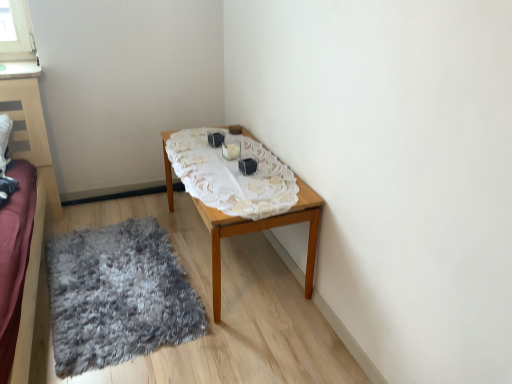
What do you see at coordinates (232, 175) in the screenshot? I see `white lace tablecloth at center` at bounding box center [232, 175].

Where is `gray shaggy rug at lower left`? The image size is (512, 384). gray shaggy rug at lower left is located at coordinates (118, 296).

From a real-world perspective, is wooden table at center above or below white lace tablecloth at center?

From a real-world perspective, wooden table at center is physically below white lace tablecloth at center.

Considering the sizes of objects wooden table at center and white lace tablecloth at center in the image provided, who is taller, wooden table at center or white lace tablecloth at center?

With more height is wooden table at center.

Can you confirm if wooden table at center is positioned to the right of white lace tablecloth at center?

Yes.

Where is `mat on the left of white lace tablecloth at center`? The width and height of the screenshot is (512, 384). mat on the left of white lace tablecloth at center is located at coordinates (118, 296).

Visually, is gray shaggy rug at lower left positioned to the left or to the right of white lace tablecloth at center?

In the image, gray shaggy rug at lower left appears on the left side of white lace tablecloth at center.

Based on the photo, from the image's perspective, which is below, gray shaggy rug at lower left or white lace tablecloth at center?

gray shaggy rug at lower left appears lower in the image.

From a real-world perspective, does gray shaggy rug at lower left sit lower than wooden table at center?

Yes, from a real-world perspective, gray shaggy rug at lower left is under wooden table at center.

Which of these two, gray shaggy rug at lower left or wooden table at center, is thinner?

With smaller width is wooden table at center.

From the image's perspective, which one is positioned lower, gray shaggy rug at lower left or wooden table at center?

gray shaggy rug at lower left appears lower in the image.

Based on the photo, is gray shaggy rug at lower left smaller than wooden table at center?

Yes, gray shaggy rug at lower left is smaller than wooden table at center.

Is wooden table at center next to gray shaggy rug at lower left and touching it?

No, wooden table at center is not touching gray shaggy rug at lower left.

From the image's perspective, would you say wooden table at center is positioned over gray shaggy rug at lower left?

Yes, from the image's perspective, wooden table at center is over gray shaggy rug at lower left.

Can you tell me how much wooden table at center and gray shaggy rug at lower left differ in facing direction?

wooden table at center and gray shaggy rug at lower left are facing 93.2 degrees away from each other.

Is wooden table at center at the left side of gray shaggy rug at lower left?

Incorrect, wooden table at center is not on the left side of gray shaggy rug at lower left.

Who is taller, white lace tablecloth at center or gray shaggy rug at lower left?

gray shaggy rug at lower left.

Considering the relative sizes of white lace tablecloth at center and gray shaggy rug at lower left in the image provided, is white lace tablecloth at center smaller than gray shaggy rug at lower left?

Yes.

Does point (296, 191) come in front of point (98, 243)?

Yes, it is in front of point (98, 243).

Relative to gray shaggy rug at lower left, is white lace tablecloth at center in front or behind?

white lace tablecloth at center is positioned farther from the viewer than gray shaggy rug at lower left.

Which is more to the right, white lace tablecloth at center or wooden table at center?

From the viewer's perspective, wooden table at center appears more on the right side.

Does white lace tablecloth at center have a greater height compared to wooden table at center?

No, white lace tablecloth at center is not taller than wooden table at center.

Is point (213, 154) more distant than point (170, 162)?

No, it is in front of (170, 162).

Which of these two, white lace tablecloth at center or wooden table at center, is bigger?

Bigger between the two is wooden table at center.

You are a GUI agent. You are given a task and a screenshot of the screen. Output one action in this format:
    pyautogui.click(x=<x>, y=<y>)
    Task: Click on the blanket above the wooden table at center (from the image's perspective)
    This screenshot has height=384, width=512.
    Given the screenshot: What is the action you would take?
    pyautogui.click(x=232, y=175)

Locate an element on the screen. Image resolution: width=512 pixels, height=384 pixels. mat in front of the white lace tablecloth at center is located at coordinates (118, 296).

Based on the photo, looking at the image, which one is located further to gray shaggy rug at lower left, wooden table at center or white lace tablecloth at center?

white lace tablecloth at center lies further to gray shaggy rug at lower left than the other object.

Considering their positions, is gray shaggy rug at lower left positioned closer to wooden table at center than white lace tablecloth at center?

Among the two, white lace tablecloth at center is located nearer to wooden table at center.

From the image, which object appears to be farther from wooden table at center, white lace tablecloth at center or gray shaggy rug at lower left?

gray shaggy rug at lower left is positioned further to the anchor wooden table at center.

Estimate the real-world distances between objects in this image. Which object is further from white lace tablecloth at center, wooden table at center or gray shaggy rug at lower left?

Among the two, gray shaggy rug at lower left is located further to white lace tablecloth at center.

Based on their spatial positions, is gray shaggy rug at lower left or wooden table at center further from white lace tablecloth at center?

Among the two, gray shaggy rug at lower left is located further to white lace tablecloth at center.

Estimate the real-world distances between objects in this image. Which object is closer to gray shaggy rug at lower left, white lace tablecloth at center or wooden table at center?

Result: Based on the image, wooden table at center appears to be nearer to gray shaggy rug at lower left.

The width and height of the screenshot is (512, 384). I want to click on blanket between gray shaggy rug at lower left and wooden table at center from left to right, so click(232, 175).